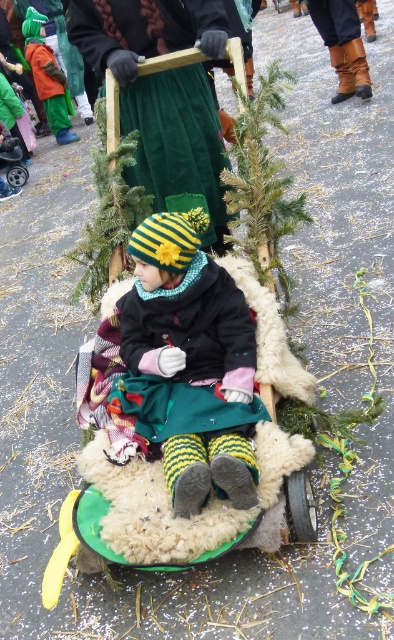
From the picture: You are a costume designer preparing for a parade. You need to ensure that the knitted woolen hat at center and the velvety green skirt at center are proportionate to each other. Based on the scene, which item is smaller in size?

The knitted woolen hat at center has a smaller size compared to the velvety green skirt at center, so the hat is smaller.

You are standing in the parade and want to take a photo of the point at coordinates [198,307]. The camera you have can focus on objects within 2 meters. Will the point be in focus?

The point at coordinates [198,307] is 2.29 meters away from the camera, which is beyond the camera focus range of 2 meters. Therefore, the point will not be in focus.